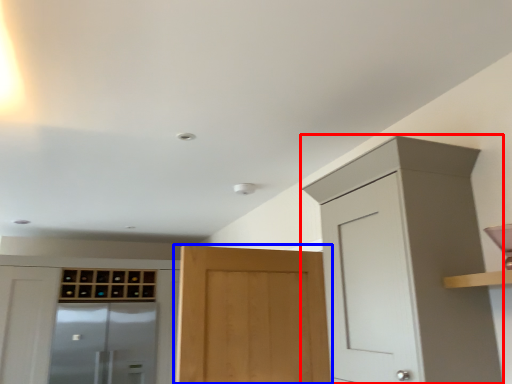
Question: Among these objects, which one is nearest to the camera, cabinetry (highlighted by a red box) or door (highlighted by a blue box)?

Choices:
 (A) cabinetry
 (B) door

Answer: (A)